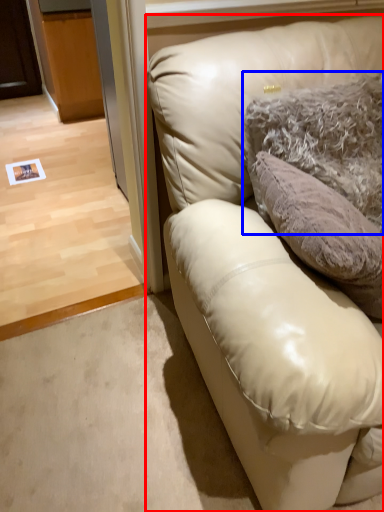
Question: Which object appears farthest to the camera in this image, studio couch (highlighted by a red box) or pillow (highlighted by a blue box)?

Choices:
 (A) studio couch
 (B) pillow

Answer: (B)